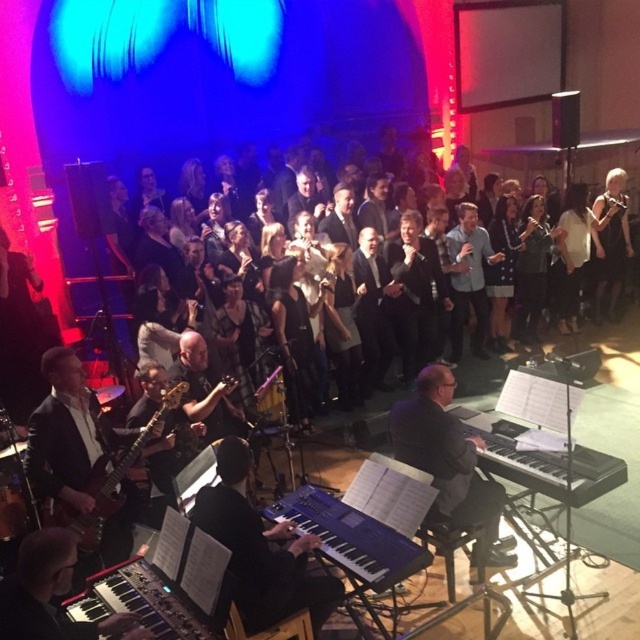
Does blue matte keyboard at center appear on the right side of matte black electric guitar at lower left?

Correct, you'll find blue matte keyboard at center to the right of matte black electric guitar at lower left.

Between blue matte keyboard at center and matte black electric guitar at lower left, which one appears on the left side from the viewer's perspective?

From the viewer's perspective, matte black electric guitar at lower left appears more on the left side.

Is point (396, 534) positioned in front of point (180, 392)?

Yes, it is.

This screenshot has width=640, height=640. In order to click on blue matte keyboard at center in this screenshot , I will do `click(352, 538)`.

Which of these two, dark gray suit at center or blue matte keyboard at center, stands shorter?

blue matte keyboard at center is shorter.

Does point (444, 493) come in front of point (301, 525)?

No, it is not.

In order to click on dark gray suit at center in this screenshot , I will do `click(448, 458)`.

Which is more to the left, black matte keyboard at center or matte black electric guitar at lower left?

matte black electric guitar at lower left

Who is taller, black matte keyboard at center or matte black electric guitar at lower left?

With more height is matte black electric guitar at lower left.

I want to click on black matte keyboard at center, so click(547, 465).